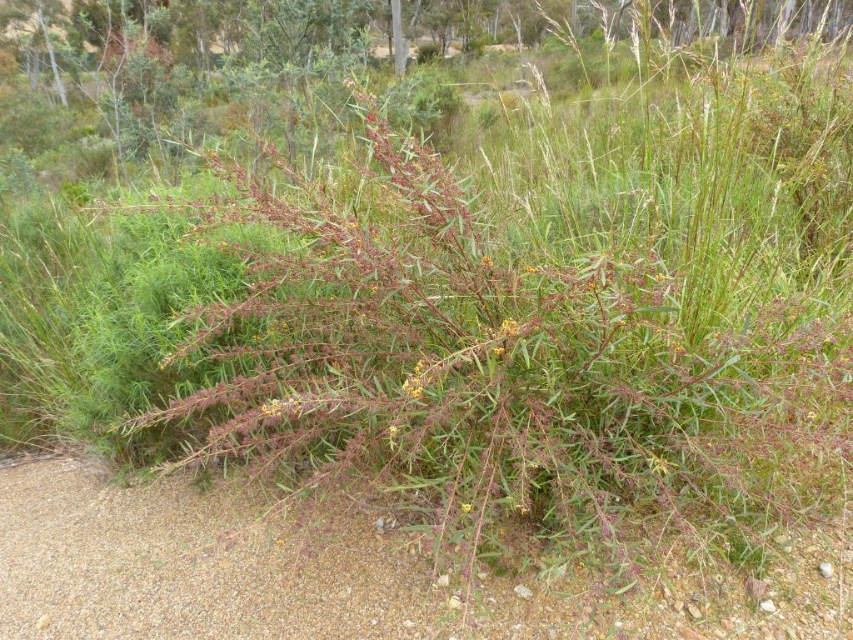
Who is positioned more to the right, gray gravel at lower left or yellow-green flower at center?

yellow-green flower at center

Who is positioned more to the left, gray gravel at lower left or yellow-green flower at center?

Positioned to the left is gray gravel at lower left.

Where is `gray gravel at lower left`? gray gravel at lower left is located at coordinates (326, 577).

The height and width of the screenshot is (640, 853). Identify the location of gray gravel at lower left. (326, 577).